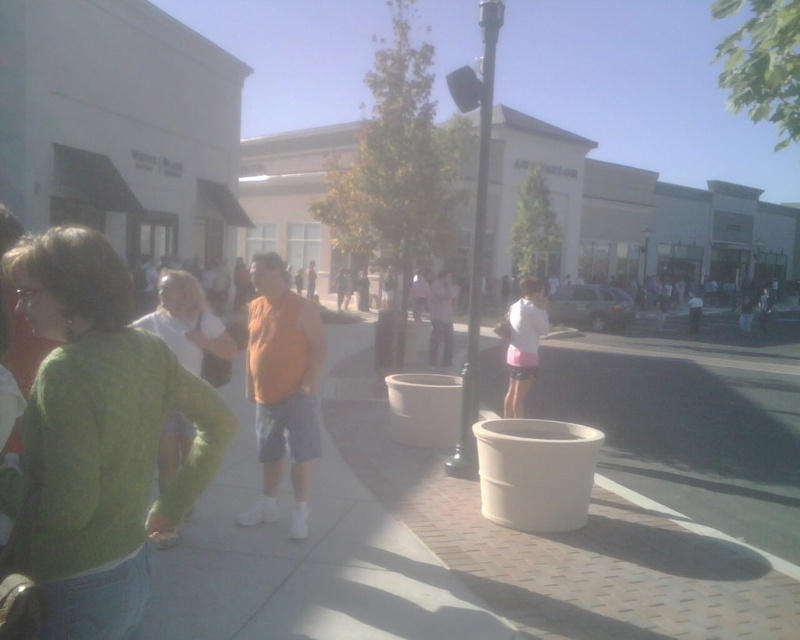
You are standing at the shopping center and see both the green knitted sweater at center and the pink fabric shorts at center. Which object is nearer to you?

The green knitted sweater at center is closer to the viewer than the pink fabric shorts at center.

You are a fashion designer observing the scene. You notice the green knitted sweater at center and the pink fabric shorts at center. Which clothing item is shorter in height?

The green knitted sweater at center is shorter in height compared to the pink fabric shorts at center.